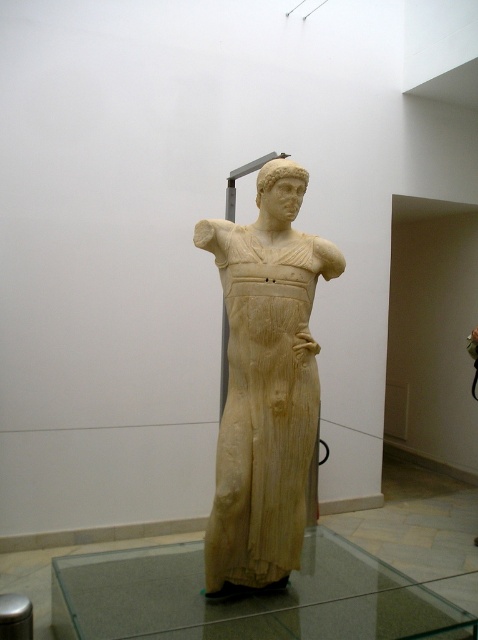
Question: Considering the relative positions of beige marble statue at center and transparent glass table at center in the image provided, where is beige marble statue at center located with respect to transparent glass table at center?

Choices:
 (A) below
 (B) above

Answer: (B)

Question: Which point is closer to the camera?

Choices:
 (A) beige marble statue at center
 (B) transparent glass table at center

Answer: (B)

Question: Is beige marble statue at center to the right of transparent glass table at center from the viewer's perspective?

Choices:
 (A) no
 (B) yes

Answer: (B)

Question: Which object appears closest to the camera in this image?

Choices:
 (A) transparent glass table at center
 (B) beige marble statue at center

Answer: (A)

Question: Is beige marble statue at center above transparent glass table at center?

Choices:
 (A) no
 (B) yes

Answer: (B)